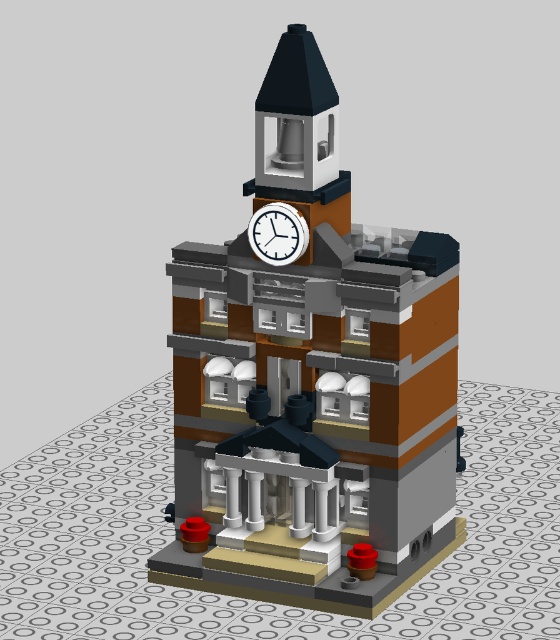
Question: Which object appears closest to the camera in this image?

Choices:
 (A) brick tower at center
 (B) white plastic clock at upper center

Answer: (A)

Question: Does brick tower at center appear under white plastic clock at upper center?

Choices:
 (A) no
 (B) yes

Answer: (B)

Question: In this image, where is brick tower at center located relative to white plastic clock at upper center?

Choices:
 (A) below
 (B) above

Answer: (A)

Question: Does brick tower at center appear on the right side of white plastic clock at upper center?

Choices:
 (A) no
 (B) yes

Answer: (B)